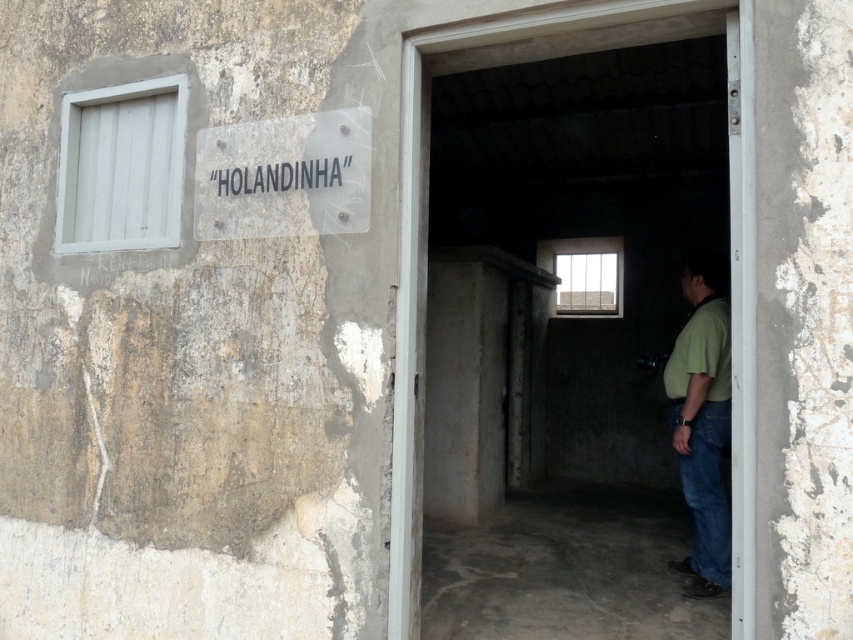
You are standing in front of the weathered building described in the scene. You need to locate the concrete door frame at center. According to the coordinates provided, where should you look to find it?

The concrete door frame at center is located at point (418, 230).

What is the exact location of the transparent plastic sign at upper left?

The transparent plastic sign at upper left is located at point (283,177).

You are a window installer assessing the exterior of a building. You notice the transparent plastic sign at upper left and the green matte shirt at center. Which object has a greater width?

The transparent plastic sign at upper left has a greater width than the green matte shirt at center according to the description.